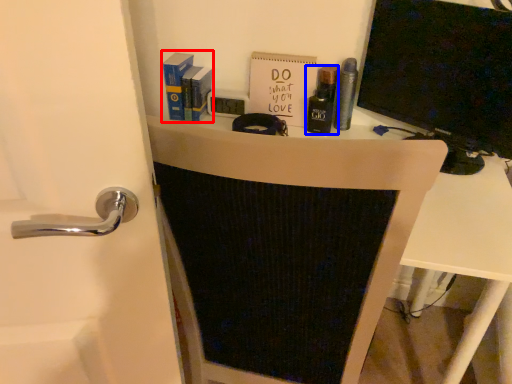
Question: Which point is further to the camera, book (highlighted by a red box) or toiletry (highlighted by a blue box)?

Choices:
 (A) book
 (B) toiletry

Answer: (A)